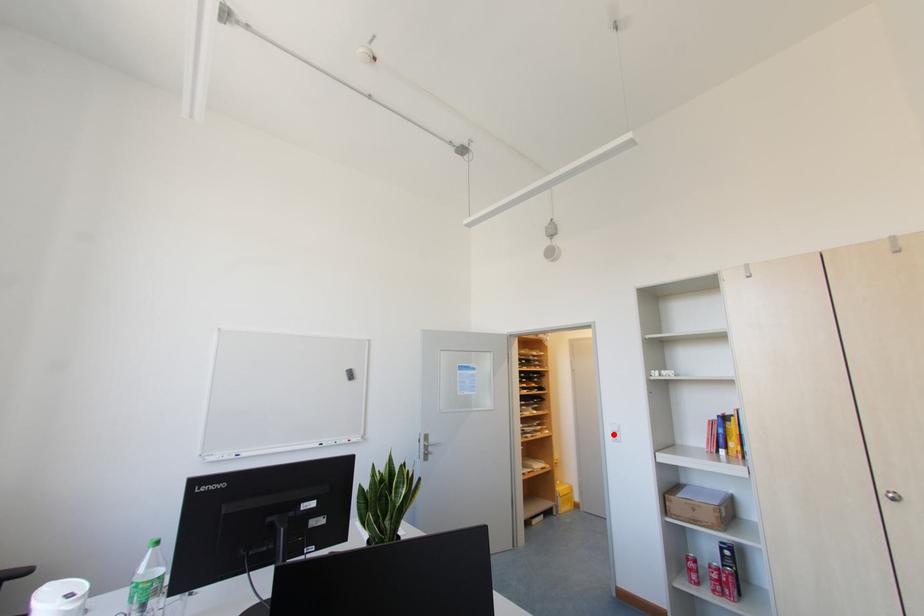
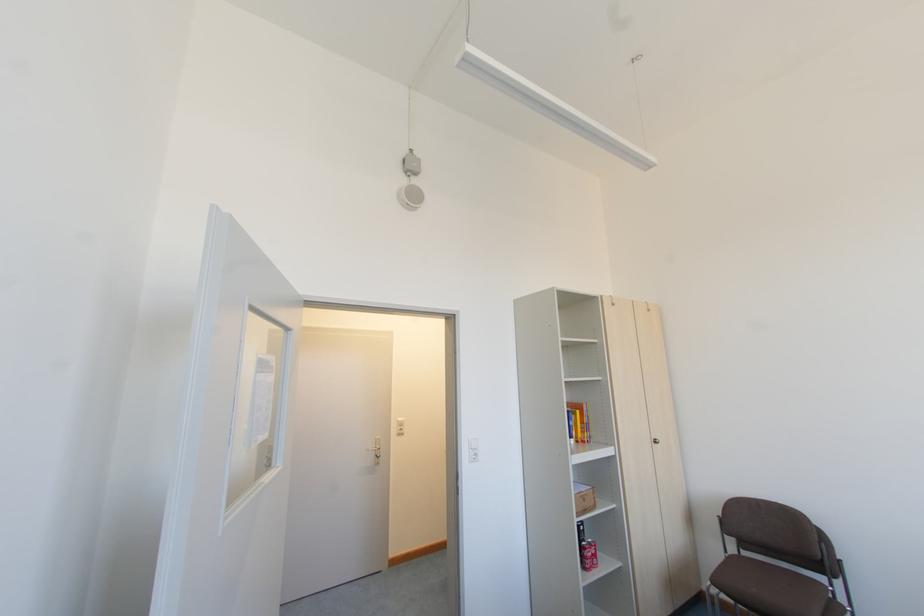
Find the pixel in the second image that matches the highlighted location in the first image.

(472, 453)